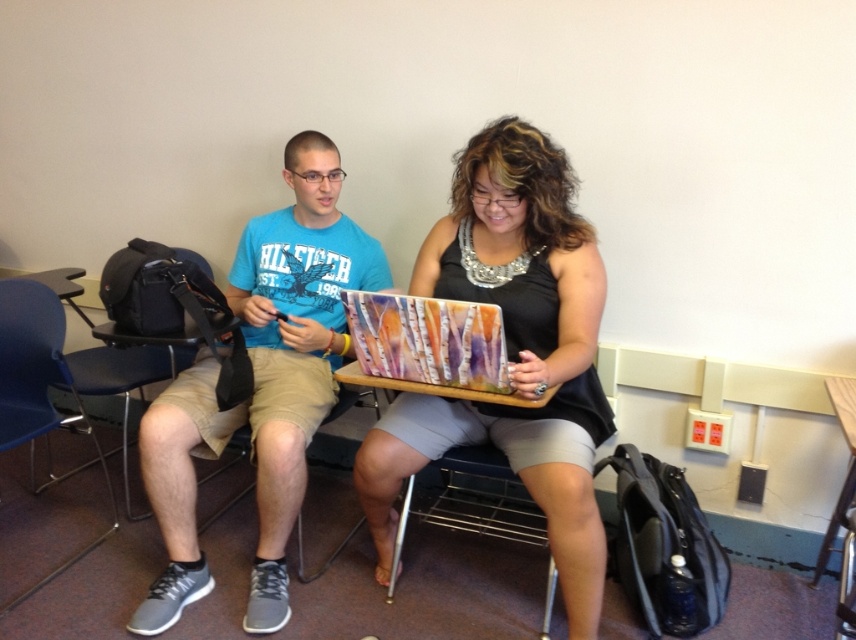
You are a person who needs to choose a chair to sit on. You want the chair with the wider seat. Which chair should you choose between the blue plastic chair at lower left and the metallic silver chair at lower center?

The metallic silver chair at lower center has a wider seat than the blue plastic chair at lower left because the blue plastic chair at lower left is thinner than the metallic silver chair at lower center.

Consider the image. You are a person sitting on the blue plastic chair at lower left. You want to reach the laptop on the small wooden table between the two people. Can you do it without moving your chair?

The blue plastic chair at lower left is positioned at point (x=37, y=385). Since the laptop is on the small wooden table between the two people, and the chair is at the lower left corner, you can stretch your arm to reach it without moving the chair.